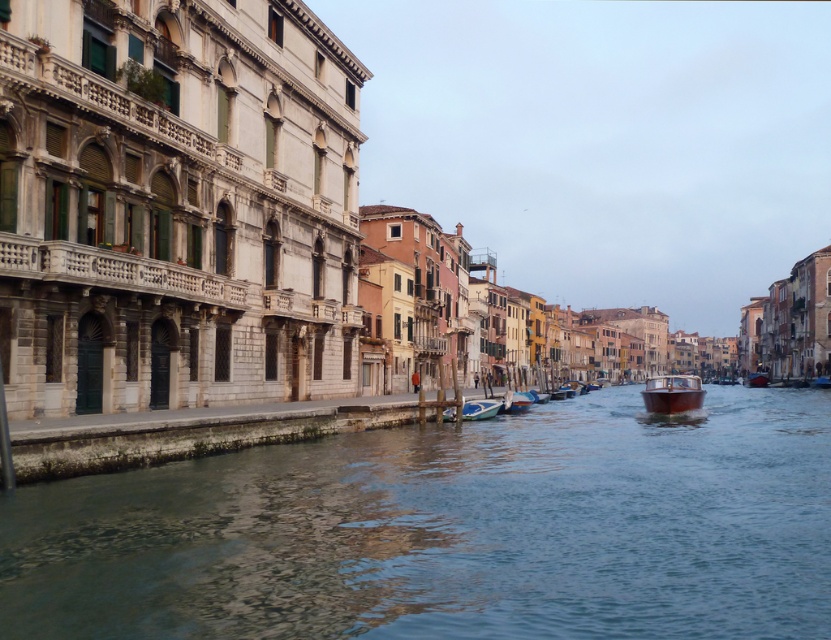
You are a tourist standing on the canal side and want to take a photo of both the wooden boat at center and the metallic blue boat at center. Which boat should you position closer to the camera to ensure both are fully visible in the frame?

You should position the wooden boat at center closer to the camera because it is in front of the metallic blue boat at center, so adjusting its position will help both boats fit into the frame without one blocking the other.

You are a tourist standing on the canal side and want to take a photo of the wooden polished boat at center and the clear water at center. Which object is positioned to the left of the other?

The clear water at center is to the left of the wooden polished boat at center.

You are standing at the edge of the canal in the scene. There is a point marked at coordinates (x=450, y=531) which indicates clear water at center. If you want to observe the clear water at center, in which direction should you look from your current position at the edge of the canal?

The point marked at (x=450, y=531) indicates clear water at center, so you should look towards the center of the canal from your position at the edge to observe the clear water at center.